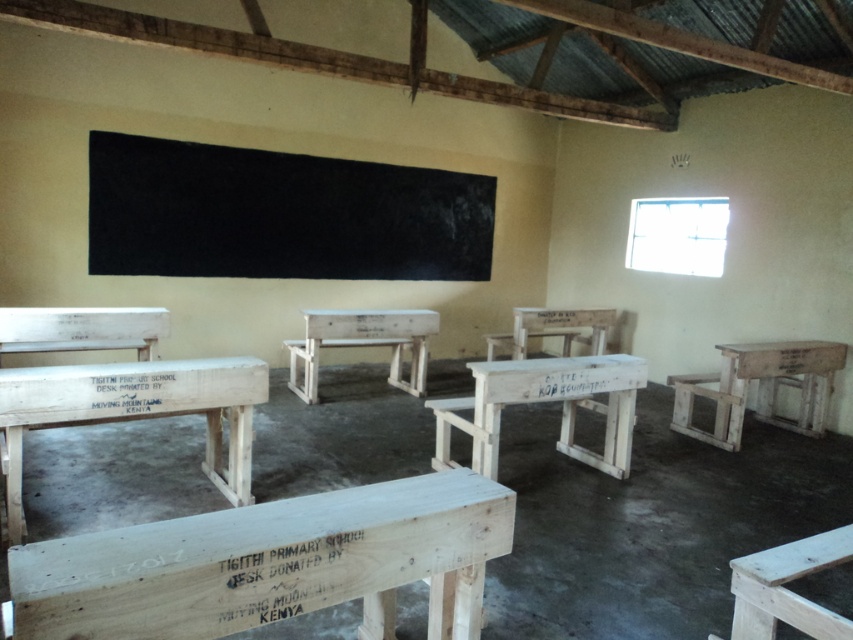
Between natural wood bench at lower left and white wood bench at left, which one has more height?

With more height is natural wood bench at lower left.

Describe the element at coordinates (134, 410) in the screenshot. This screenshot has width=853, height=640. I see `natural wood bench at lower left` at that location.

Locate an element on the screen. Image resolution: width=853 pixels, height=640 pixels. natural wood bench at lower left is located at coordinates (134, 410).

Between natural wood bench at center and black matte/blackboard at upper center, which one has less height?

natural wood bench at center

Does natural wood bench at center appear on the right side of black matte/blackboard at upper center?

Yes, natural wood bench at center is to the right of black matte/blackboard at upper center.

Does point (310, 605) come closer to viewer compared to point (442, 236)?

Yes.

You are a GUI agent. You are given a task and a screenshot of the screen. Output one action in this format:
    pyautogui.click(x=<x>, y=<y>)
    Task: Click on the natural wood bench at center
    
    Given the screenshot: What is the action you would take?
    pyautogui.click(x=270, y=563)

Does light wood table at lower right have a greater width compared to light brown wooden stool at lower right?

In fact, light wood table at lower right might be narrower than light brown wooden stool at lower right.

The image size is (853, 640). What do you see at coordinates (786, 588) in the screenshot?
I see `light wood table at lower right` at bounding box center [786, 588].

The height and width of the screenshot is (640, 853). In order to click on light wood table at lower right in this screenshot , I will do tap(786, 588).